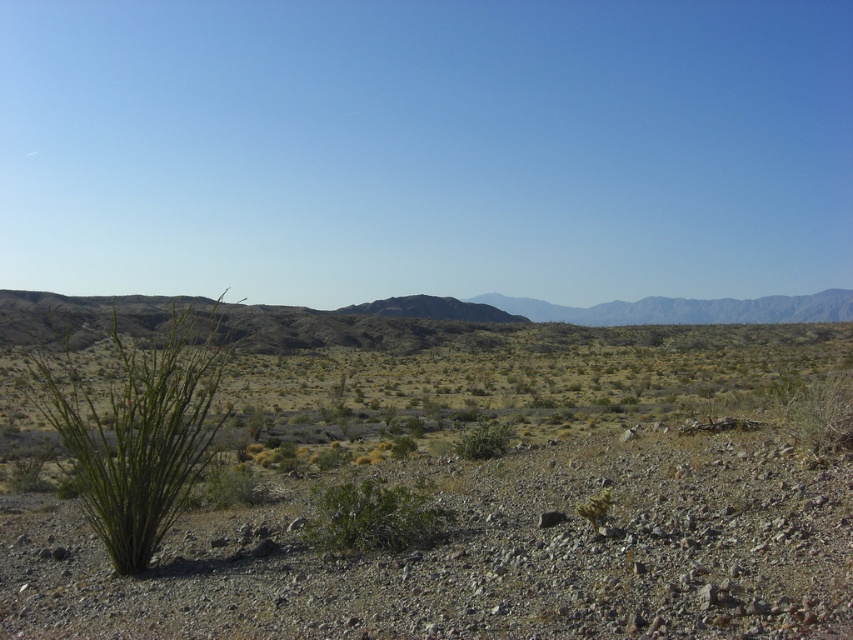
You are a hiker who wants to take a photo of the green shrub at center and the green spiny plant at left from a distance of 10 meters. Can you stand at a position where both are in the same frame without moving the camera? Explain your reasoning.

The green shrub at center is 10.87 meters away from the green spiny plant at left. Since the distance between them is greater than 10 meters, you cannot stand at a position where both are within the same 10 meter frame without moving the camera.

You are standing at the point marked as point (x=375, y=515) in the desert scene. What object is exactly at your current position?

The green leafy bush at center is located at point (x=375, y=515), so the object exactly at your current position is the green leafy bush at center.